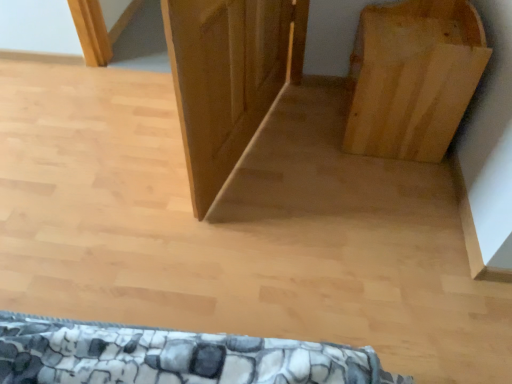
This screenshot has height=384, width=512. In order to click on vacant area situated to the left side of wooden door at center in this screenshot , I will do `click(109, 149)`.